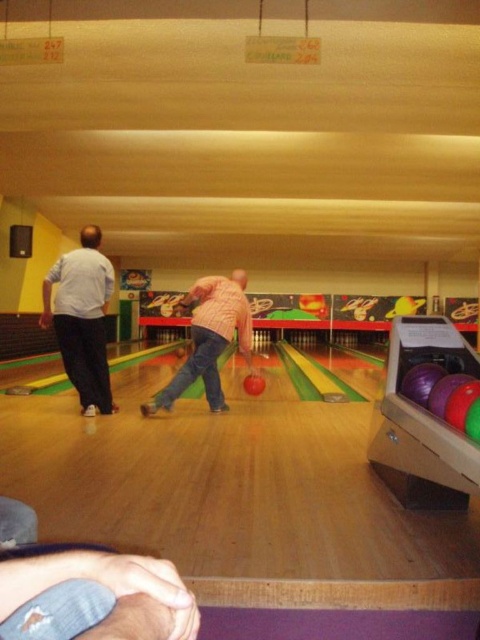
Question: Considering the relative positions of white matte shirt at left and pink matte shirt at center in the image provided, where is white matte shirt at left located with respect to pink matte shirt at center?

Choices:
 (A) below
 (B) above

Answer: (B)

Question: Does white matte shirt at left come behind pink matte shirt at center?

Choices:
 (A) no
 (B) yes

Answer: (A)

Question: Is white matte shirt at left positioned in front of pink matte shirt at center?

Choices:
 (A) no
 (B) yes

Answer: (B)